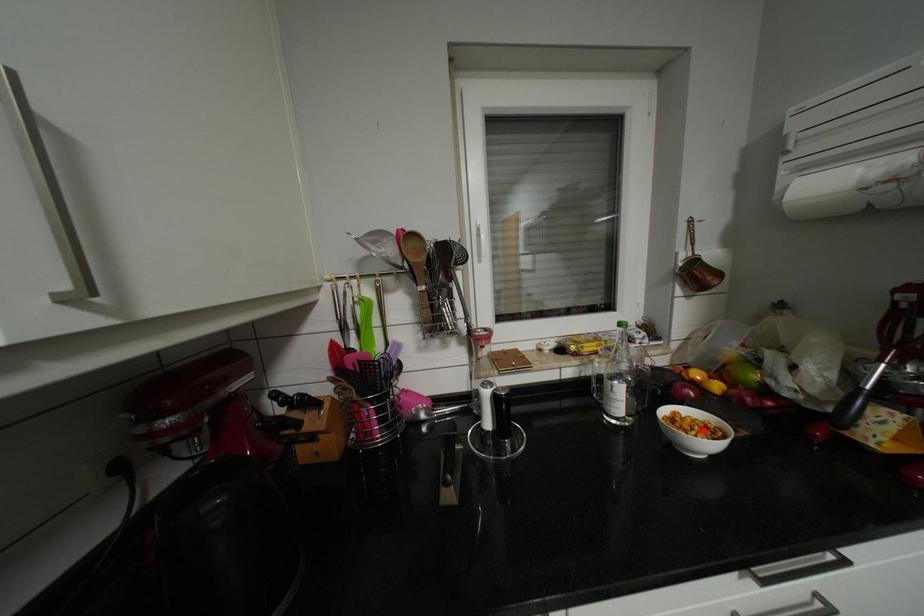
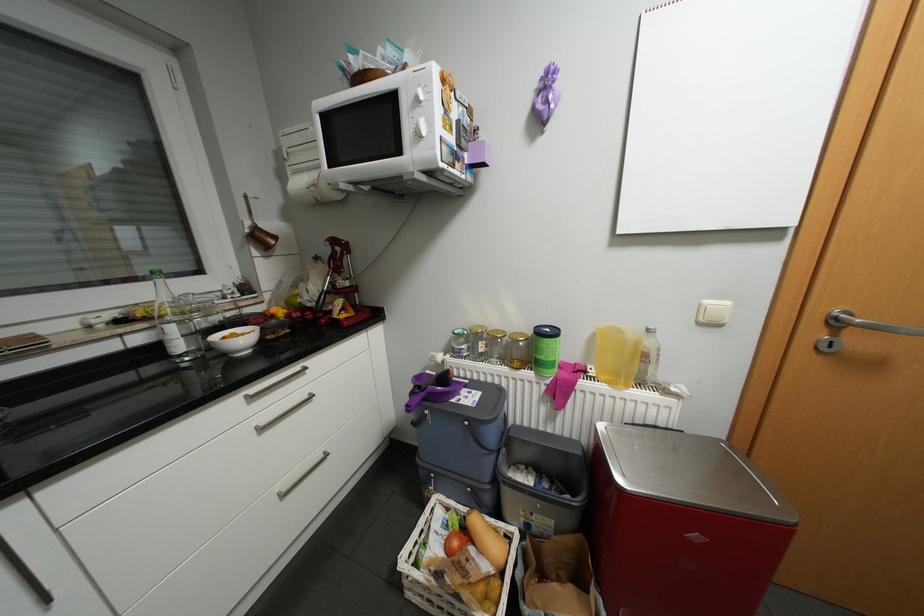
In the second image, find the point that corresponds to the highlighted location in the first image.

(249, 339)